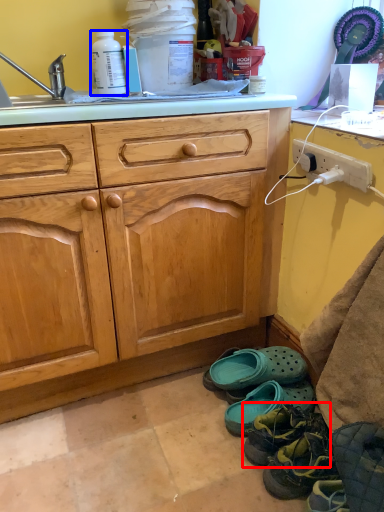
Question: Which object is further to the camera taking this photo, footwear (highlighted by a red box) or bottle (highlighted by a blue box)?

Choices:
 (A) footwear
 (B) bottle

Answer: (B)